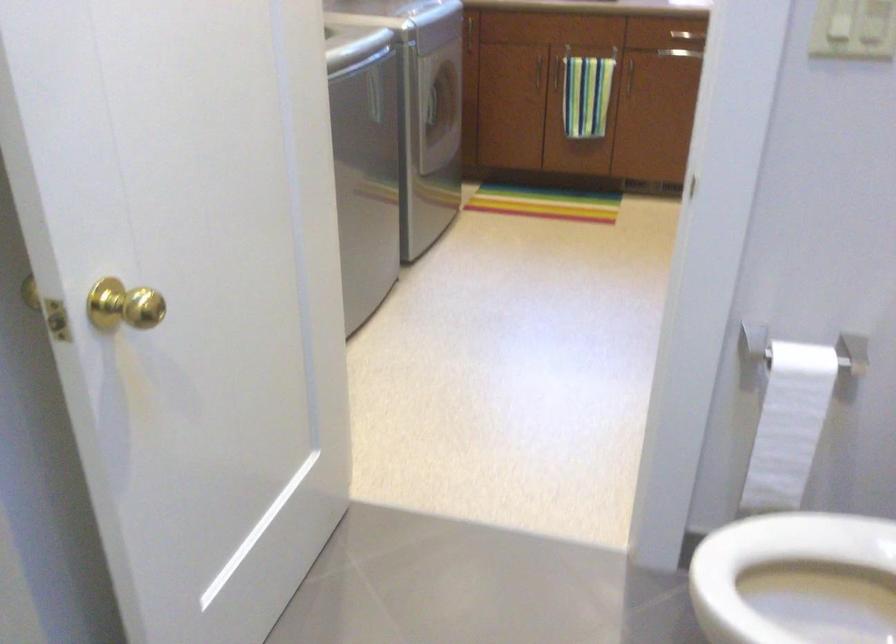
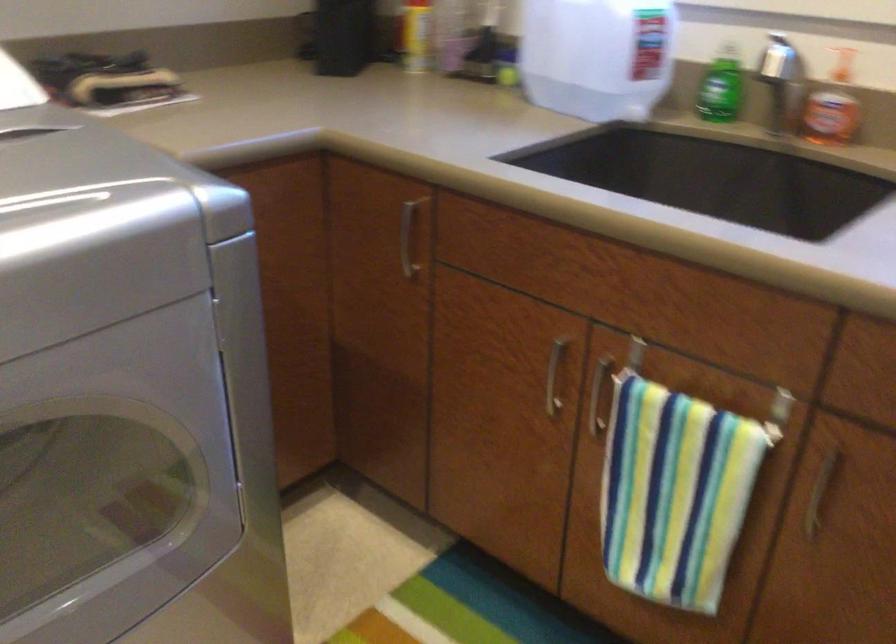
Where in the second image is the point corresponding to (530,71) from the first image?

(554, 375)